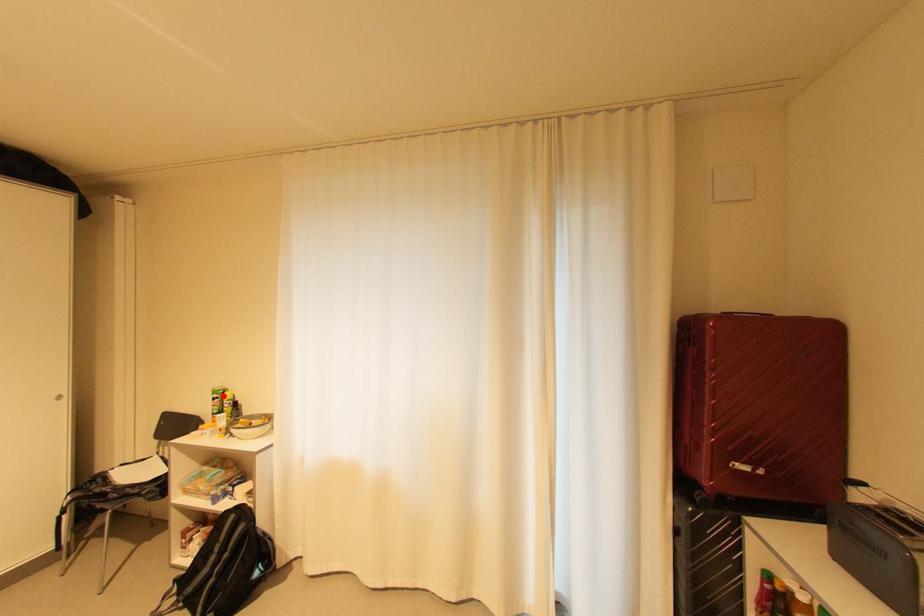
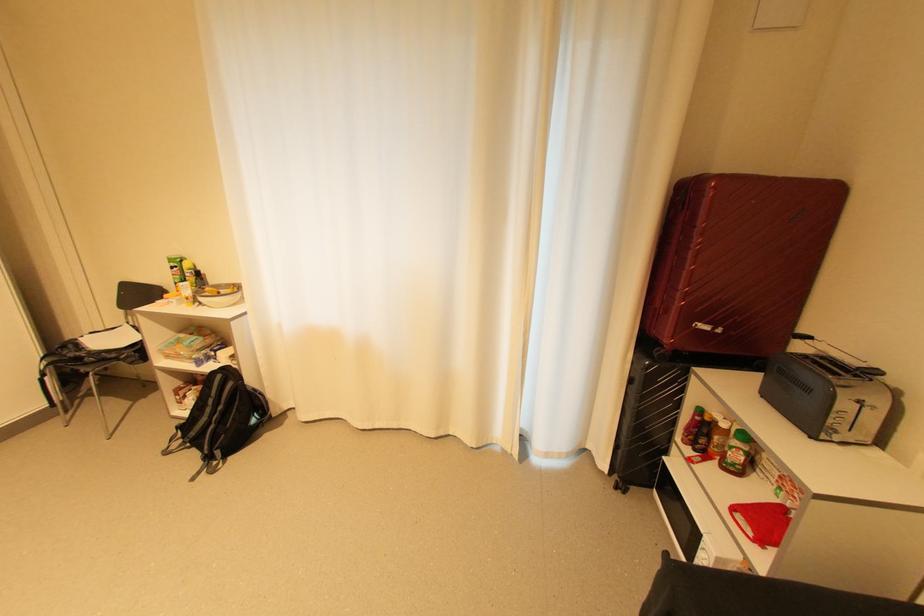
Find the pixel in the second image that matches the highlighted location in the first image.

(180, 265)